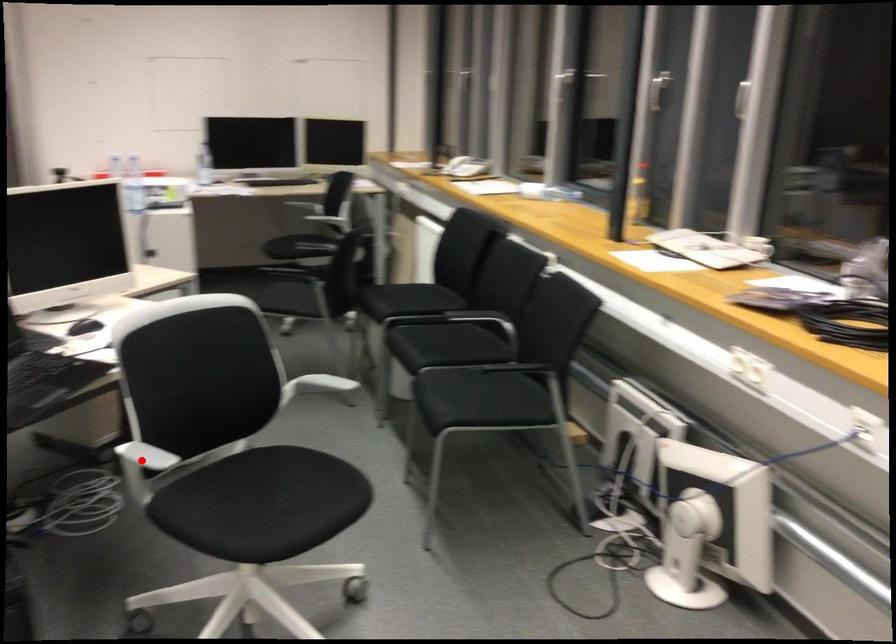
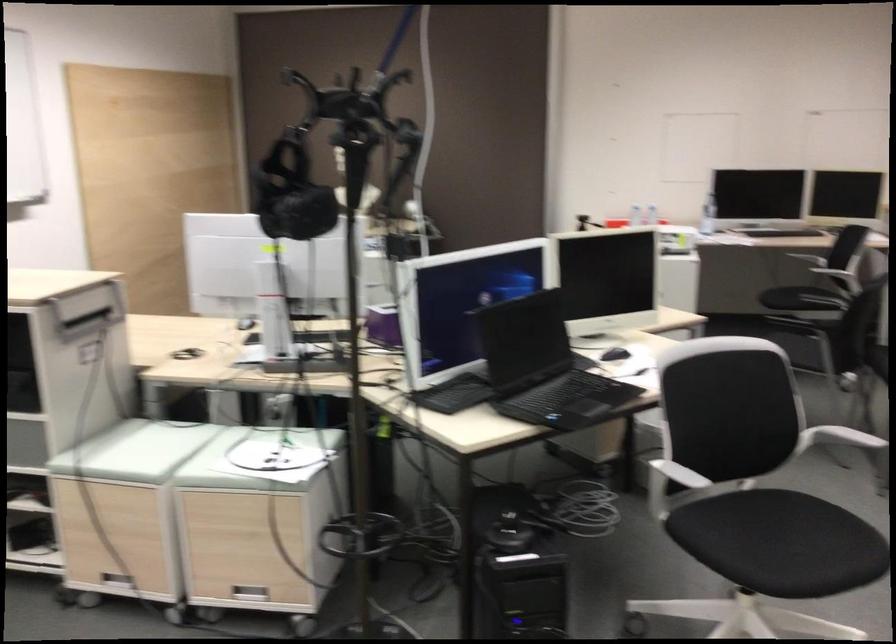
Find the pixel in the second image that matches the highlighted location in the first image.

(679, 474)